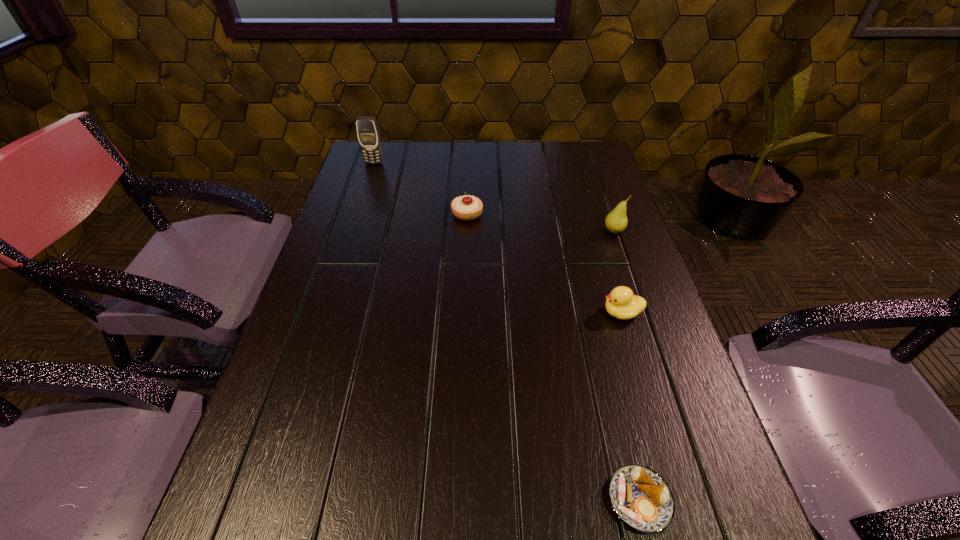
At what (x,y) coordinates should I click in order to perform the action: click on pastry located in the right edge section of the desktop. Please return your answer as a coordinate pair (x, y). Image resolution: width=960 pixels, height=540 pixels. Looking at the image, I should click on (640, 498).

The width and height of the screenshot is (960, 540). Find the location of `object present at the far left corner`. object present at the far left corner is located at coordinates (368, 134).

Where is `vacant area at the far edge`? The image size is (960, 540). vacant area at the far edge is located at coordinates pyautogui.click(x=439, y=143).

Find the location of a particular element. The image size is (960, 540). free region at the left edge of the desktop is located at coordinates (363, 269).

In the image, there is a desktop. In order to click on vacant space at the right edge in this screenshot , I will do `click(650, 284)`.

The width and height of the screenshot is (960, 540). What are the coordinates of `vacant point located between the second nearest object and the tallest object` in the screenshot? It's located at (497, 238).

Locate an element on the screen. This screenshot has width=960, height=540. free space that is in between the tallest object and the pear is located at coordinates [x=493, y=197].

This screenshot has width=960, height=540. Identify the location of free space between the pear and the leftmost object. (493, 197).

Find the location of `empty location between the duckling and the farthest object`. empty location between the duckling and the farthest object is located at coordinates click(x=497, y=238).

Where is `vacant area between the farther pastry and the nearest object`? vacant area between the farther pastry and the nearest object is located at coordinates (553, 357).